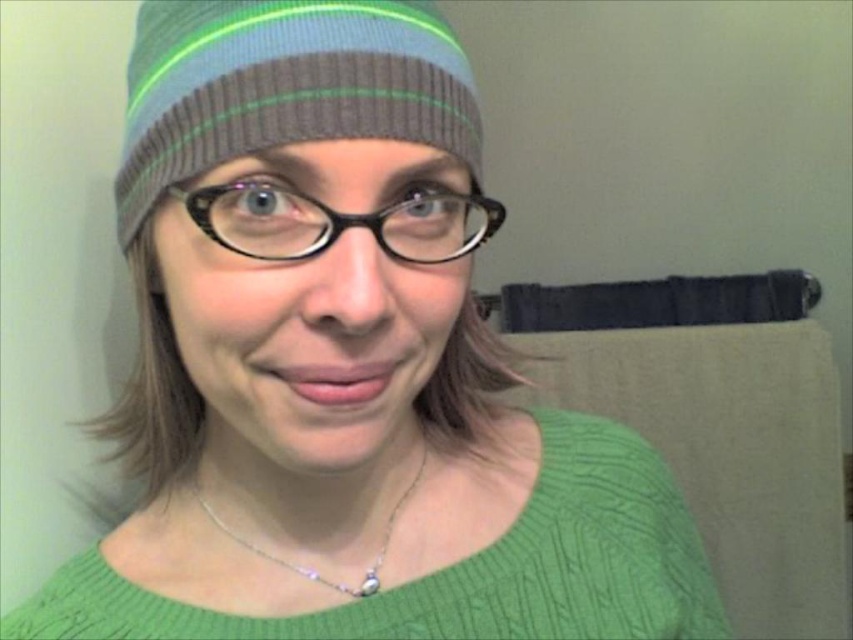
From the picture: Does striped knit beanie at upper center have a lesser width compared to silver/glass necklace at center?

No.

Can you confirm if striped knit beanie at upper center is positioned below silver/glass necklace at center?

No, striped knit beanie at upper center is not below silver/glass necklace at center.

Locate an element on the screen. This screenshot has height=640, width=853. striped knit beanie at upper center is located at coordinates (283, 84).